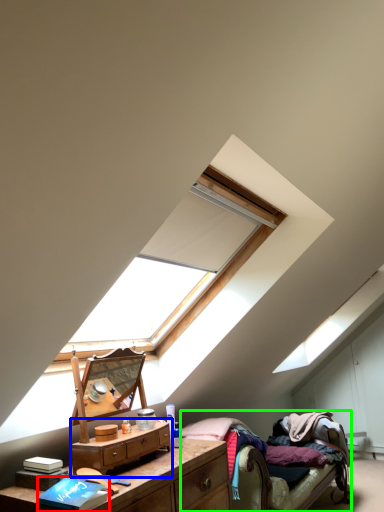
Question: Which object is positioned closest to book (highlighted by a red box)? Select from nightstand (highlighted by a blue box) and bed (highlighted by a green box).

Choices:
 (A) nightstand
 (B) bed

Answer: (A)